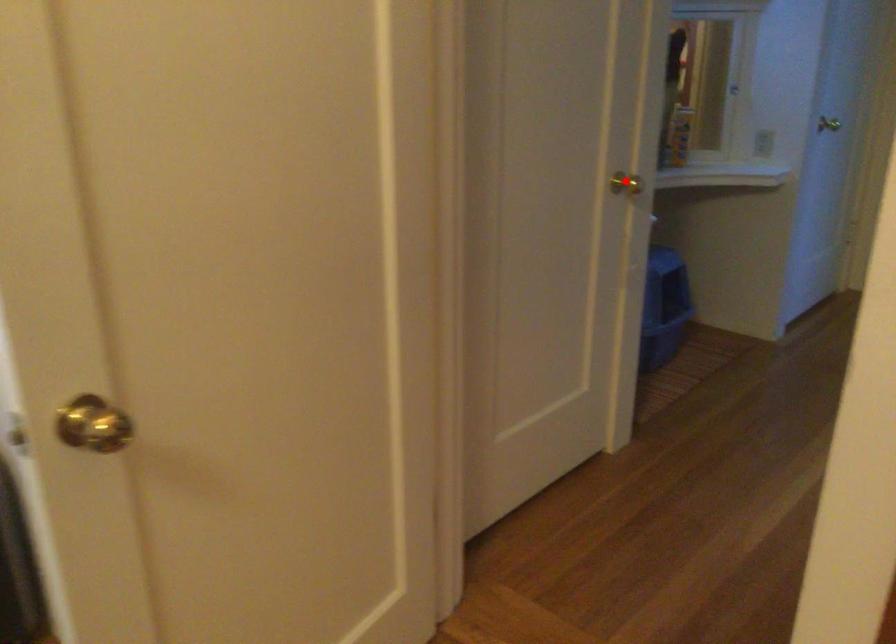
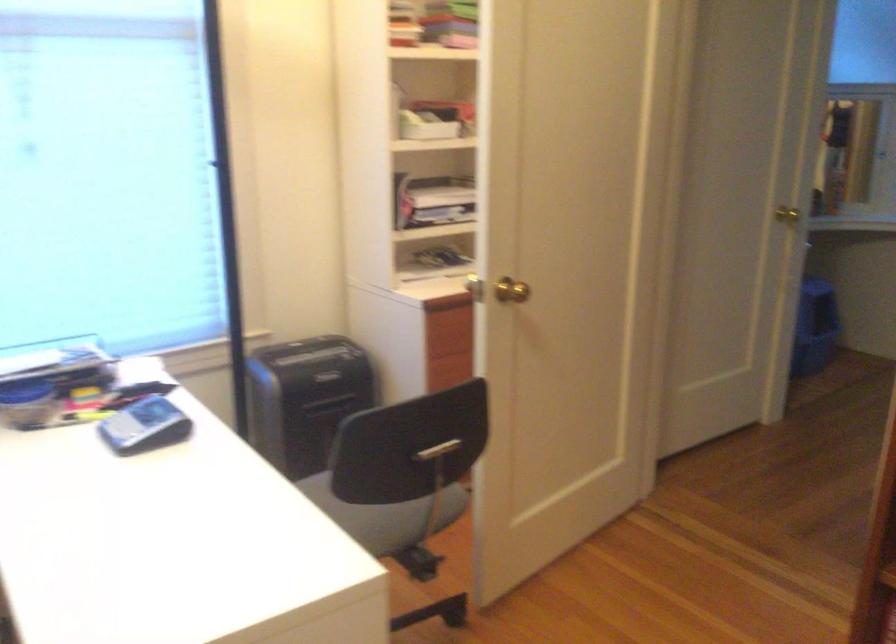
The point at the highlighted location is marked in the first image. Where is the corresponding point in the second image?

(787, 214)